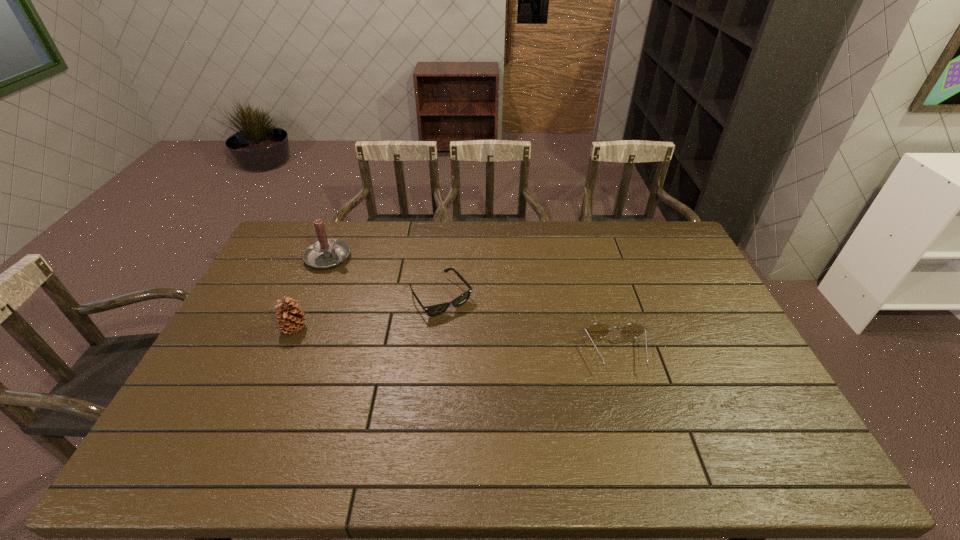
The image size is (960, 540). I want to click on free space on the desktop that is between the second tallest object and the rightmost object and is positioned on the side of the farthest object with the handle loop, so coord(470,342).

What are the coordinates of `vacant space on the desktop that is between the third shortest object and the rightmost object and is positioned on the front-facing side of the sunglasses` in the screenshot? It's located at 476,343.